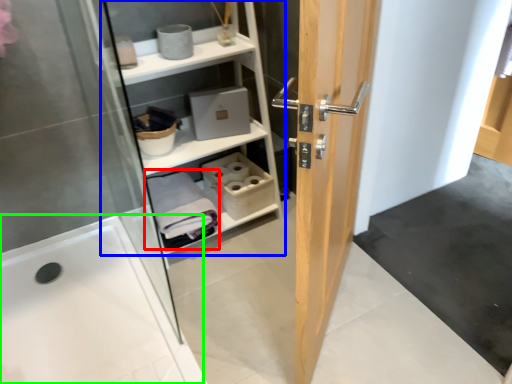
Question: Estimate the real-world distances between objects in this image. Which object is closer to bath towel (highlighted by a red box), shelf (highlighted by a blue box) or bath (highlighted by a green box)?

Choices:
 (A) shelf
 (B) bath

Answer: (A)